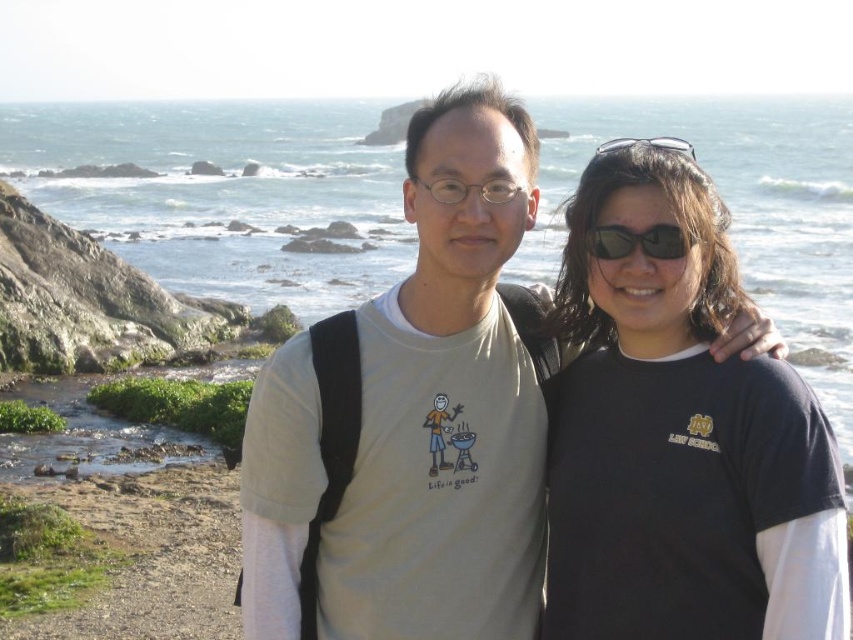
Question: Can you confirm if sunglasses at center is positioned above clear plastic sunglasses at upper center?

Choices:
 (A) no
 (B) yes

Answer: (A)

Question: Which point is closer to the camera taking this photo?

Choices:
 (A) (648, 141)
 (B) (535, 138)
 (C) (612, 243)
 (D) (641, 577)

Answer: (D)

Question: Where is black matte t-shirt at center located in relation to sunglasses at center in the image?

Choices:
 (A) above
 (B) below

Answer: (B)

Question: Is black matte t-shirt at center to the left of clear plastic sunglasses at upper center from the viewer's perspective?

Choices:
 (A) yes
 (B) no

Answer: (A)

Question: Which object is positioned closest to the beige cotton t-shirt at center?

Choices:
 (A) clear plastic sunglasses at upper center
 (B) sunglasses at center
 (C) black matte t-shirt at center

Answer: (B)

Question: Which point is closer to the camera taking this photo?

Choices:
 (A) (721, 232)
 (B) (294, 480)

Answer: (B)